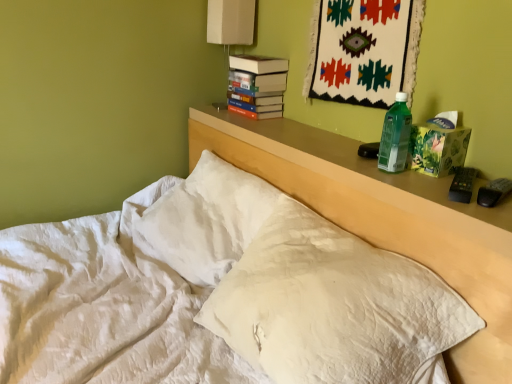
Locate an element on the screen. The height and width of the screenshot is (384, 512). free space in front of green plastic bottle at right is located at coordinates (421, 183).